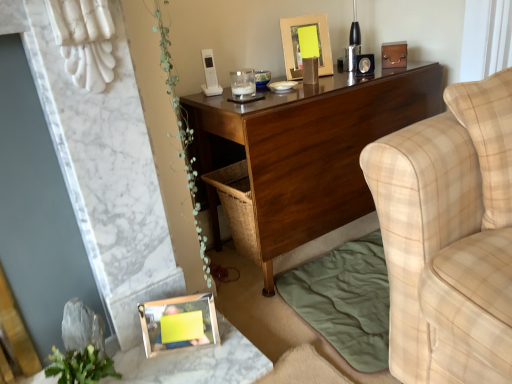
Question: From a real-world perspective, is wooden photo frame at lower left, placed as the second picture frame when sorted from right to left, physically located above or below beige plaid fabric couch at right?

Choices:
 (A) below
 (B) above

Answer: (A)

Question: Is wooden photo frame at lower left, placed as the 1th picture frame when sorted from bottom to top, spatially inside beige plaid fabric couch at right, or outside of it?

Choices:
 (A) inside
 (B) outside

Answer: (B)

Question: Which is farther from the wooden frame at lower left?

Choices:
 (A) green leafy plant at lower left
 (B) gold metallic picture frame at upper center, which is counted as the first picture frame, starting from the back
 (C) wooden photo frame at lower left, placed as the second picture frame when sorted from right to left
 (D) beige plaid fabric couch at right
 (E) dark wood desk at center

Answer: (B)

Question: Which of these objects is positioned farthest from the wooden frame at lower left?

Choices:
 (A) green leafy plant at lower left
 (B) wooden photo frame at lower left, which is counted as the first picture frame, starting from the front
 (C) gold metallic picture frame at upper center, acting as the 1th picture frame starting from the top
 (D) beige plaid fabric couch at right
 (E) dark wood desk at center

Answer: (C)